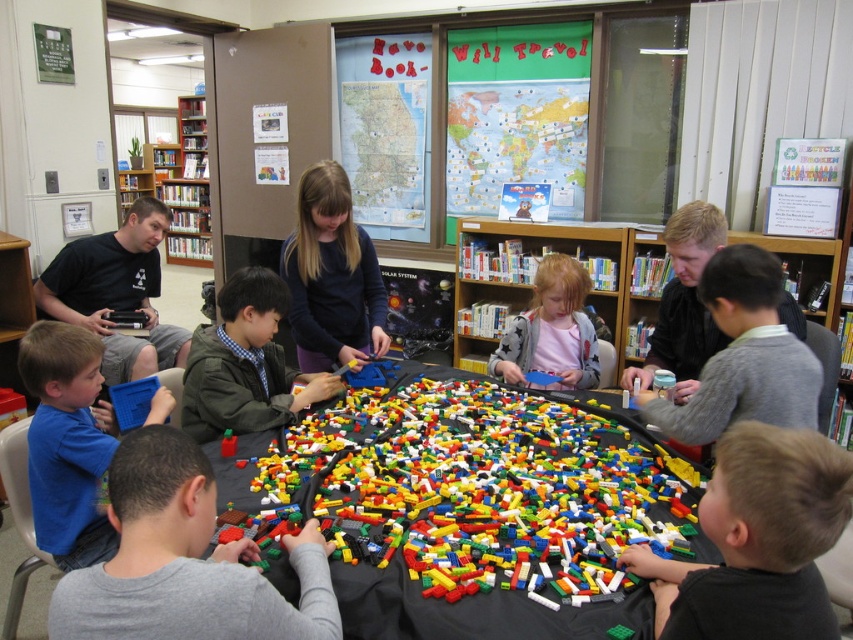
Question: Is matte blue shirt at center smaller than green matte jacket at center?

Choices:
 (A) no
 (B) yes

Answer: (A)

Question: Is wooden bookshelf at center thinner than light pink fabric at center?

Choices:
 (A) yes
 (B) no

Answer: (B)

Question: Which point is farther from the camera taking this photo?

Choices:
 (A) (74, 412)
 (B) (756, 412)
 (C) (405, 554)
 (D) (225, 440)

Answer: (D)

Question: Which object is the farthest from the blue matte tablet at lower left?

Choices:
 (A) green matte jacket at center
 (B) matte gray sweater at right
 (C) translucent plastic brick at center

Answer: (B)

Question: Is black fabric table at center positioned before dark gray shirt at lower right?

Choices:
 (A) yes
 (B) no

Answer: (B)

Question: Which point appears closest to the camera in this image?

Choices:
 (A) (178, 556)
 (B) (434, 448)
 (C) (213, 330)

Answer: (A)